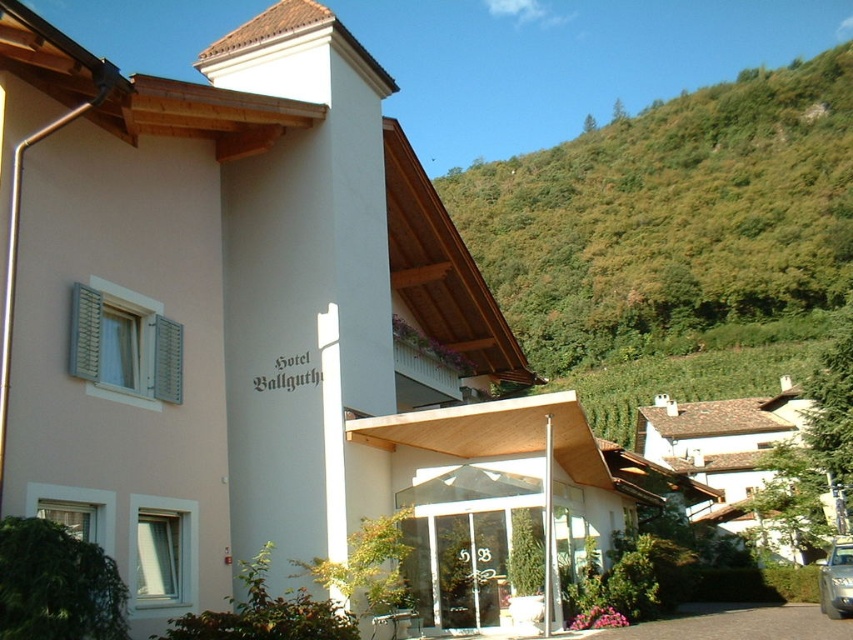
Who is positioned more to the right, white stucco house at center or silver metallic car at lower right?

white stucco house at center is more to the right.

Describe the element at coordinates (730, 458) in the screenshot. I see `white stucco house at center` at that location.

What are the coordinates of `white stucco house at center` in the screenshot? It's located at (730, 458).